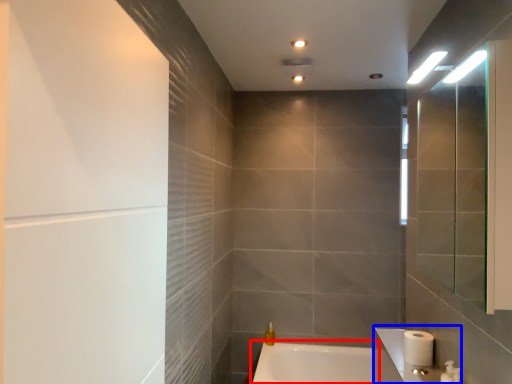
Question: Among these objects, which one is farthest to the camera, bathtub (highlighted by a red box) or sink (highlighted by a blue box)?

Choices:
 (A) bathtub
 (B) sink

Answer: (A)